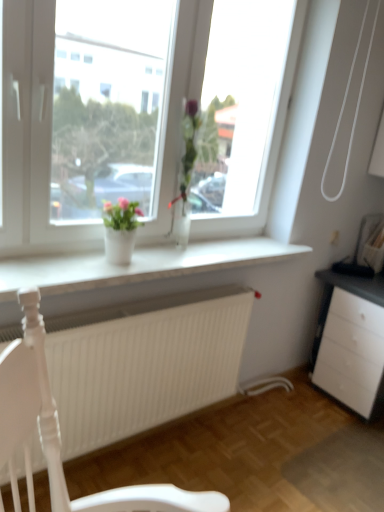
You are a GUI agent. You are given a task and a screenshot of the screen. Output one action in this format:
    pyautogui.click(x=<x>, y=<y>)
    Task: Click on the vacant region below white matte radiator at lower center (from a real-world perspective)
    
    Given the screenshot: What is the action you would take?
    pyautogui.click(x=147, y=445)